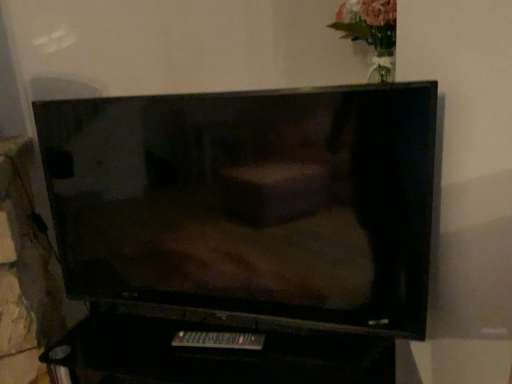
Question: Does black plastic remote at lower center have a lesser width compared to matte black tv at center?

Choices:
 (A) yes
 (B) no

Answer: (A)

Question: Is matte black tv at center inside black plastic remote at lower center?

Choices:
 (A) yes
 (B) no

Answer: (B)

Question: Can we say black plastic remote at lower center lies outside matte black tv at center?

Choices:
 (A) no
 (B) yes

Answer: (B)

Question: Is black plastic remote at lower center oriented away from matte black tv at center?

Choices:
 (A) no
 (B) yes

Answer: (A)

Question: From a real-world perspective, is black plastic remote at lower center on top of matte black tv at center?

Choices:
 (A) yes
 (B) no

Answer: (B)

Question: Could you tell me if black plastic remote at lower center is turned towards matte black tv at center?

Choices:
 (A) yes
 (B) no

Answer: (B)

Question: Is matte black tv at center wider than black plastic remote at lower center?

Choices:
 (A) no
 (B) yes

Answer: (B)

Question: Considering the relative sizes of matte black tv at center and black plastic remote at lower center in the image provided, is matte black tv at center bigger than black plastic remote at lower center?

Choices:
 (A) yes
 (B) no

Answer: (A)

Question: Can you see matte black tv at center touching black plastic remote at lower center?

Choices:
 (A) yes
 (B) no

Answer: (B)

Question: Considering the relative positions of matte black tv at center and black plastic remote at lower center in the image provided, is matte black tv at center in front of black plastic remote at lower center?

Choices:
 (A) no
 (B) yes

Answer: (B)

Question: Would you say matte black tv at center is outside black plastic remote at lower center?

Choices:
 (A) yes
 (B) no

Answer: (A)

Question: From the image's perspective, is matte black tv at center beneath black plastic remote at lower center?

Choices:
 (A) no
 (B) yes

Answer: (A)

Question: Considering the positions of matte black tv at center and black plastic remote at lower center in the image, is matte black tv at center wider or thinner than black plastic remote at lower center?

Choices:
 (A) wide
 (B) thin

Answer: (A)